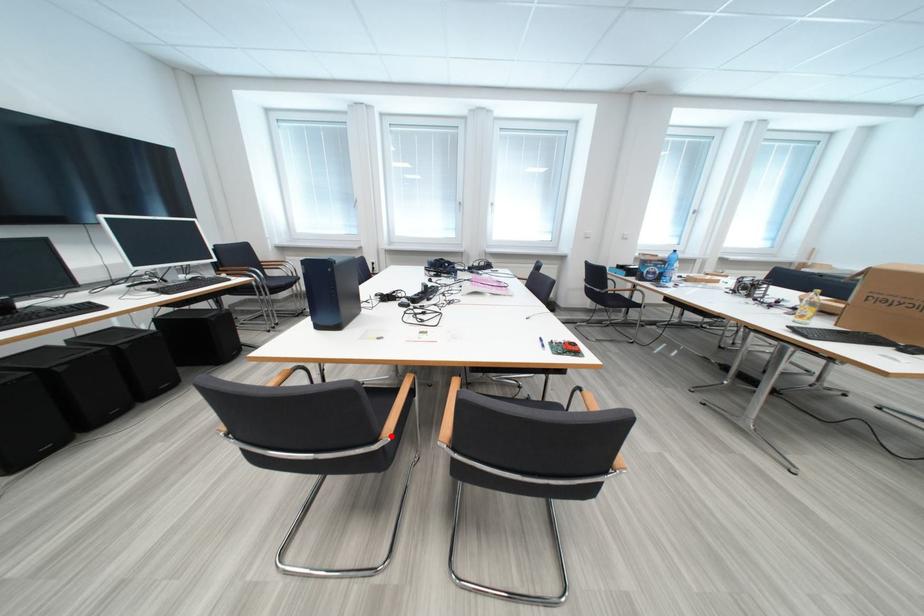
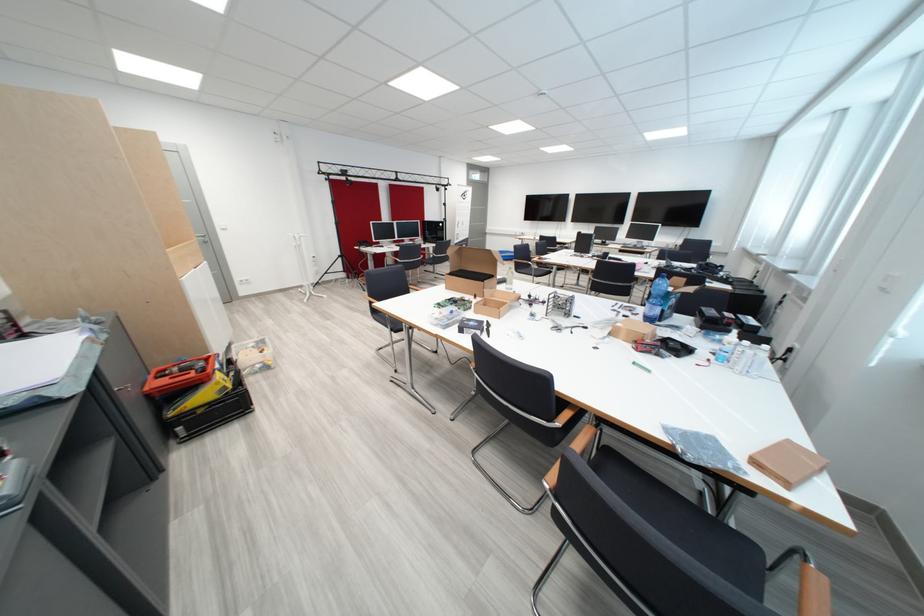
Question: I am providing you with two images of the same scene from different viewpoints. A red point is marked on the first image. Can you still see the location of the red point in image 2?

Choices:
 (A) Yes
 (B) No

Answer: (B)